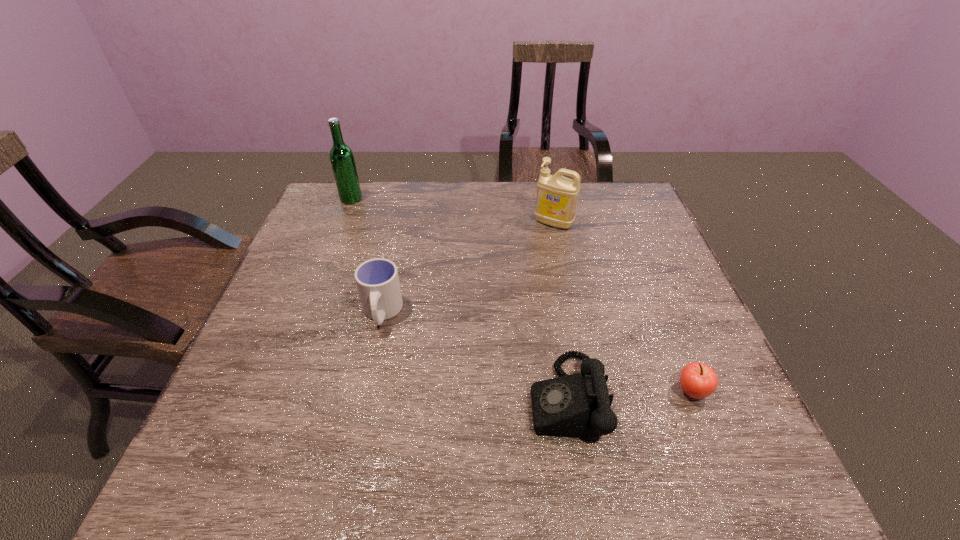
Locate an element on the screen. This screenshot has width=960, height=540. object at the right edge is located at coordinates (698, 380).

Image resolution: width=960 pixels, height=540 pixels. I want to click on object situated at the far left corner, so (342, 160).

The image size is (960, 540). In the image, there is a desktop. In order to click on vacant space at the far edge in this screenshot , I will do `click(442, 218)`.

In the image, there is a desktop. Where is `vacant space at the near edge`? This screenshot has height=540, width=960. vacant space at the near edge is located at coordinates (674, 466).

Identify the location of free region at the left edge. (274, 326).

Locate an element on the screen. blank space at the right edge is located at coordinates click(667, 331).

Image resolution: width=960 pixels, height=540 pixels. In the image, there is a desktop. Identify the location of free space at the far left corner. (352, 214).

Where is `free space at the far right corner of the desktop`? free space at the far right corner of the desktop is located at coordinates pyautogui.click(x=627, y=183).

This screenshot has height=540, width=960. In the image, there is a desktop. In order to click on vacant region at the near right corner in this screenshot , I will do `click(723, 446)`.

Where is `vacant point located between the apple and the beer bottle`? This screenshot has height=540, width=960. vacant point located between the apple and the beer bottle is located at coordinates (521, 295).